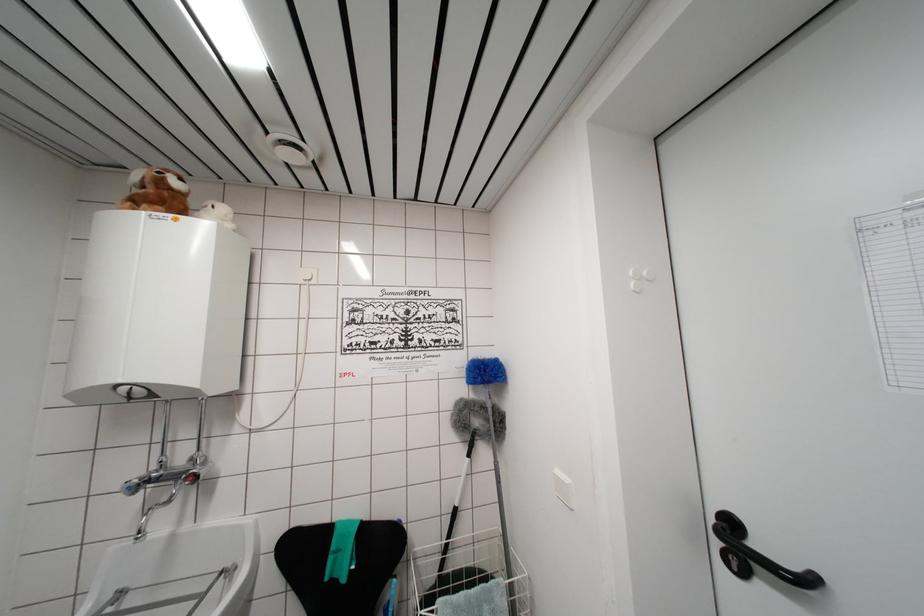
At what (x,y) coordinates should I click in order to perform the action: click on blue duster. Please return your answer as a coordinate pair (x, y). This screenshot has width=924, height=616. Looking at the image, I should click on (489, 458).